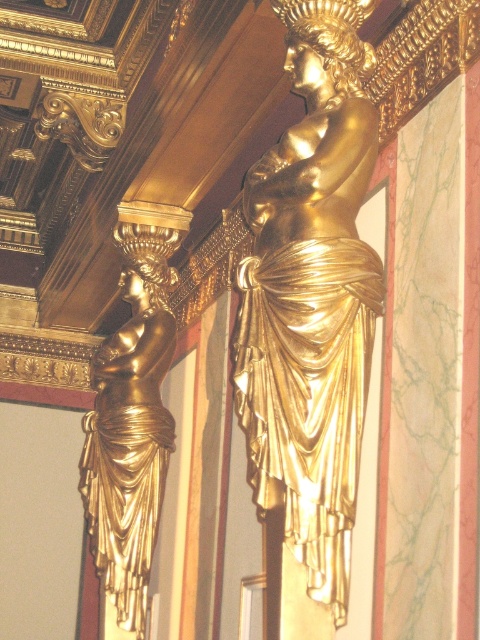
Does gold polished statue at center appear on the left side of gold/gilded draped figure at left?

No, gold polished statue at center is not to the left of gold/gilded draped figure at left.

Can you confirm if gold polished statue at center is shorter than gold/gilded draped figure at left?

Indeed, gold polished statue at center has a lesser height compared to gold/gilded draped figure at left.

Does point (256, 493) come farther from viewer compared to point (105, 454)?

No, it is not.

The height and width of the screenshot is (640, 480). Find the location of `gold polished statue at center`. gold polished statue at center is located at coordinates (311, 301).